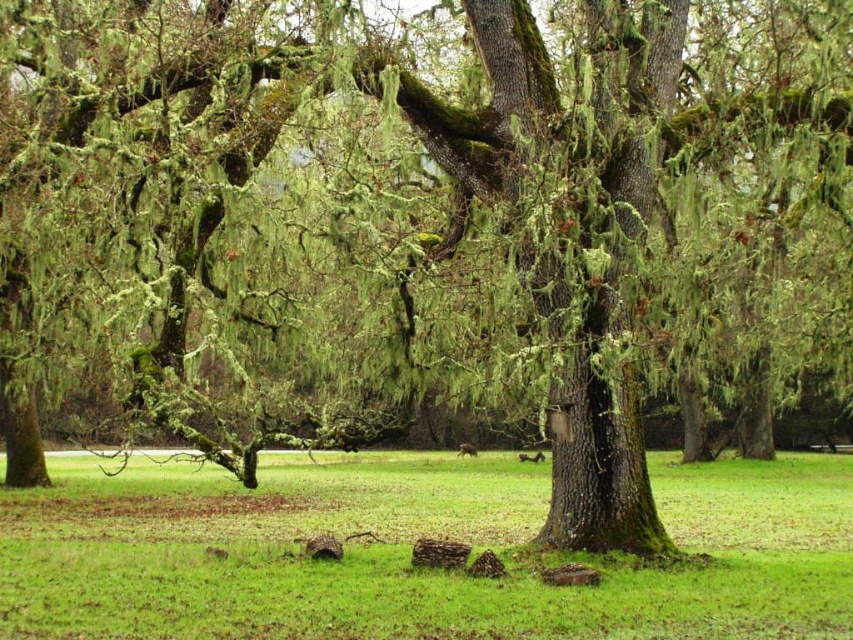
Is green grass at center bigger than brown furry squirrel at center?

Yes, green grass at center is bigger than brown furry squirrel at center.

The height and width of the screenshot is (640, 853). Describe the element at coordinates (409, 552) in the screenshot. I see `green grass at center` at that location.

Is point (399, 588) positioned behind point (476, 451)?

That is False.

At what (x,y) coordinates should I click in order to perform the action: click on green grass at center. Please return your answer as a coordinate pair (x, y). This screenshot has width=853, height=640. Looking at the image, I should click on (409, 552).